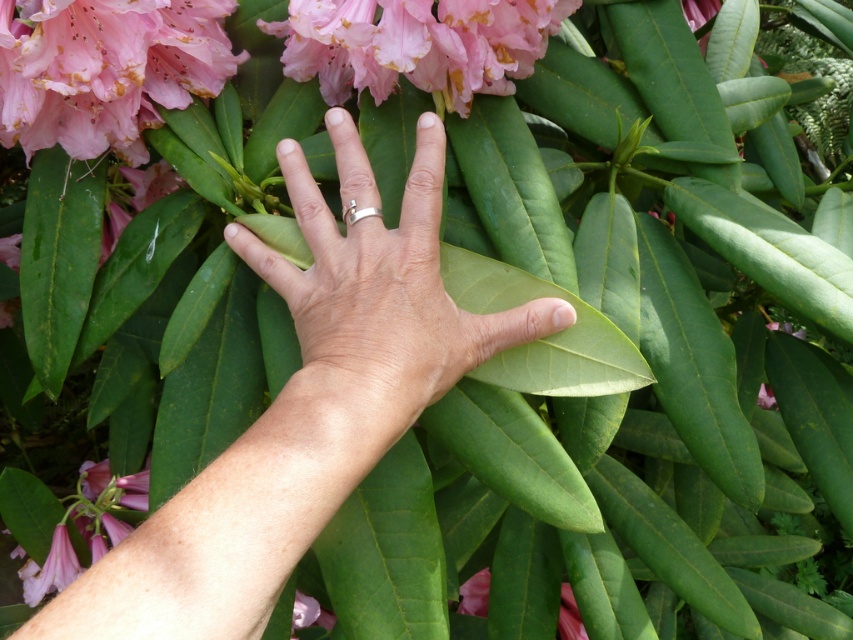
You are a florist arranging a bouquet and need to place the pink glossy flower at upper center and the pink matte flower at lower left. The vase you have is 30 inches wide. Can both flowers fit side by side in the vase?

The pink glossy flower at upper center is 31.63 inches from the pink matte flower at lower left, which means they cannot fit side by side in a 30 inch wide vase as the distance between them exceeds the vase width.

In the scene shown: You are a jeweler examining a hand holding a ring and flowers. You need to place a protective cover over the satin gold ring at center and the matte pink petals at upper left. Which object requires a taller cover?

The satin gold ring at center requires a taller cover because it is much taller than the matte pink petals at upper left.